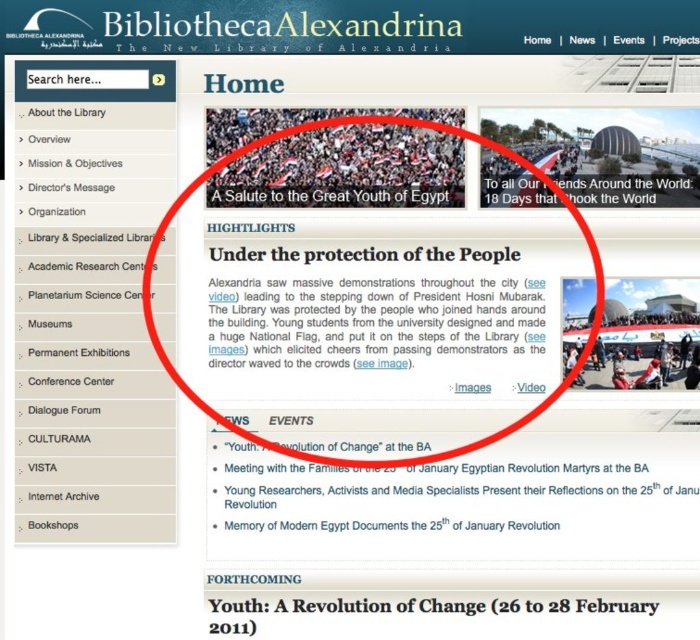
Question: Observing the image, what is the correct spatial positioning of blue fabric banner at upper right in reference to matte black flag at center?

Choices:
 (A) left
 (B) right

Answer: (A)

Question: Can you confirm if blue fabric banner at upper right is positioned to the left of matte black flag at center?

Choices:
 (A) yes
 (B) no

Answer: (A)

Question: Is blue fabric banner at upper right positioned before matte black flag at center?

Choices:
 (A) yes
 (B) no

Answer: (B)

Question: Which point is farther to the camera?

Choices:
 (A) blue fabric banner at upper right
 (B) matte black flag at center

Answer: (A)

Question: Which point is farther to the camera?

Choices:
 (A) matte black flag at center
 (B) blue fabric banner at upper right

Answer: (B)